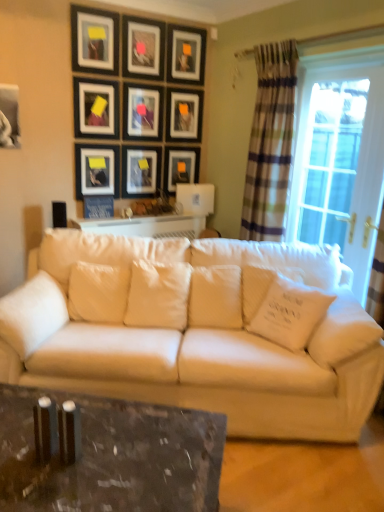
Question: In terms of size, does clear glass window at right appear bigger or smaller than matte black picture frame at upper center, the second picture frame positioned from the top?

Choices:
 (A) small
 (B) big

Answer: (B)

Question: From a real-world perspective, is clear glass window at right above or below matte black picture frame at upper center, the second picture frame positioned from the top?

Choices:
 (A) above
 (B) below

Answer: (B)

Question: Which object is the closest to the white soft pillow at right, which is counted as the fifth pillow, starting from the left?

Choices:
 (A) matte black picture frame at center, the fifth picture frame from the top
 (B) white fabric pillow at center, acting as the 4th pillow starting from the right
 (C) matte black picture frame at upper center, the 4th picture frame from the top
 (D) plaid fabric curtain at right
 (E) matte black picture frame at upper center, which is the 9th picture frame in bottom-to-top order

Answer: (D)

Question: Estimate the real-world distances between objects in this image. Which object is closer to the white soft pillow at right, which is counted as the fifth pillow, starting from the left?

Choices:
 (A) white soft pillow at left, the first pillow positioned from the left
 (B) matte black picture frame at center, the fifth picture frame from the top
 (C) matte black picture frame at upper center, which is the 9th picture frame in bottom-to-top order
 (D) white quilted pillow at center, which is the second pillow from right to left
 (E) blue fabric picture frame at upper left, which appears as the first picture frame when ordered from the bottom

Answer: (D)